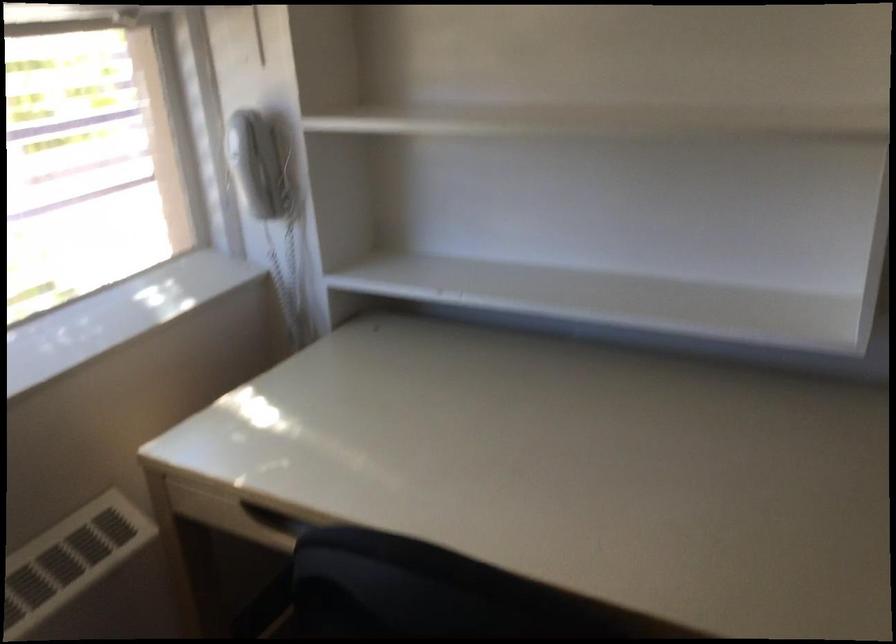
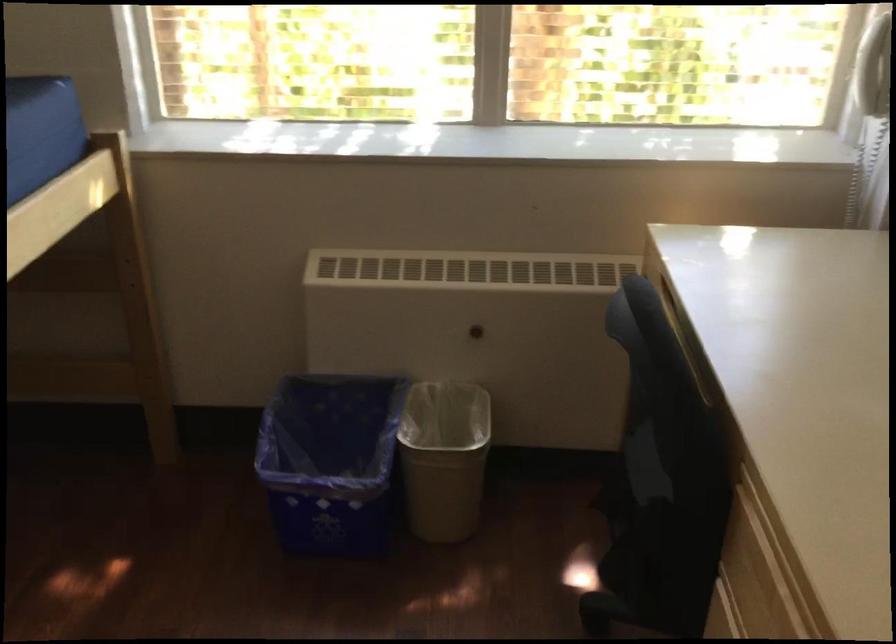
In the second image, find the point that corresponds to (255,180) in the first image.

(874, 69)